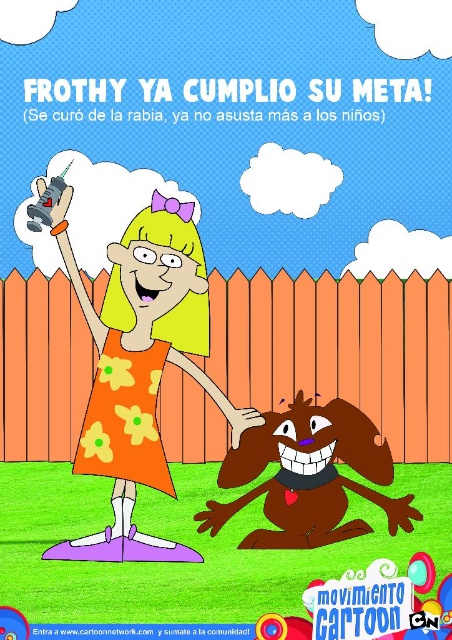
Question: Does orange floral dress at center have a smaller size compared to brown furry dog at lower center?

Choices:
 (A) yes
 (B) no

Answer: (B)

Question: Is orange floral dress at center in front of brown furry dog at lower center?

Choices:
 (A) no
 (B) yes

Answer: (A)

Question: Which point is farther from the camera taking this photo?

Choices:
 (A) click(299, 426)
 (B) click(106, 387)

Answer: (B)

Question: Which point is farther to the camera?

Choices:
 (A) (381, 481)
 (B) (112, 252)

Answer: (B)

Question: Is orange floral dress at center behind brown furry dog at lower center?

Choices:
 (A) yes
 (B) no

Answer: (A)